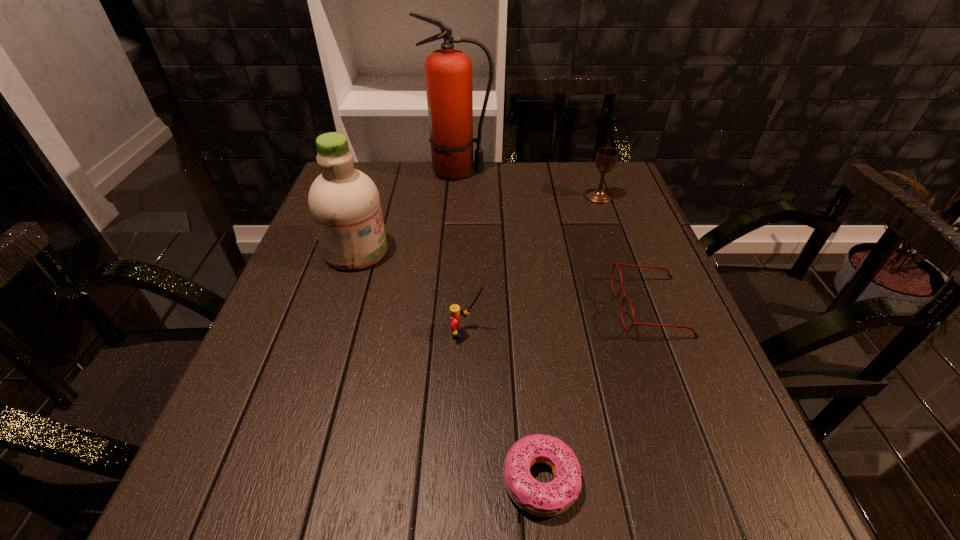
You are a GUI agent. You are given a task and a screenshot of the screen. Output one action in this format:
    pyautogui.click(x=<x>, y=<y>)
    Task: Click on the object situated at the near edge
    The width and height of the screenshot is (960, 540).
    Given the screenshot: What is the action you would take?
    pyautogui.click(x=541, y=499)

Locate an element on the screen. Image resolution: width=960 pixels, height=540 pixels. object at the left edge is located at coordinates (344, 202).

Identify the location of chalice at the right edge. Image resolution: width=960 pixels, height=540 pixels. (606, 158).

You are a GUI agent. You are given a task and a screenshot of the screen. Output one action in this format:
    pyautogui.click(x=<x>, y=<y>)
    Task: Click on the spectacles at the right edge
    
    Given the screenshot: What is the action you would take?
    pyautogui.click(x=617, y=264)

Where is `object located in the far right corner section of the desktop`? object located in the far right corner section of the desktop is located at coordinates (606, 158).

I want to click on vacant region at the far edge of the desktop, so click(562, 174).

Where is `free space at the near edge`? This screenshot has width=960, height=540. free space at the near edge is located at coordinates (645, 529).

Find the location of a particular element. free space at the left edge is located at coordinates (317, 435).

The image size is (960, 540). I want to click on free space at the right edge of the desktop, so click(x=705, y=430).

You are a GUI agent. You are given a task and a screenshot of the screen. Output one action in this format:
    pyautogui.click(x=<x>, y=<y>)
    Task: Click on the blank space at the far left corner of the desktop
    
    Given the screenshot: What is the action you would take?
    coord(387,167)